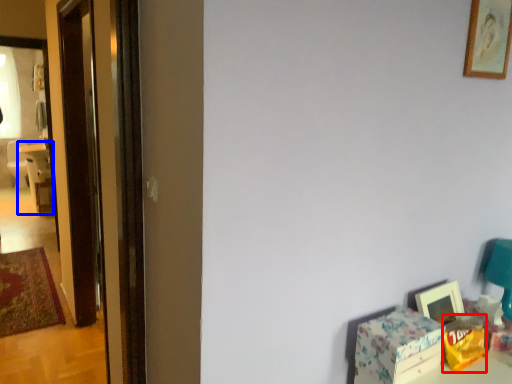
Question: Which object is closer to the camera taking this photo, box (highlighted by a red box) or chair (highlighted by a blue box)?

Choices:
 (A) box
 (B) chair

Answer: (A)